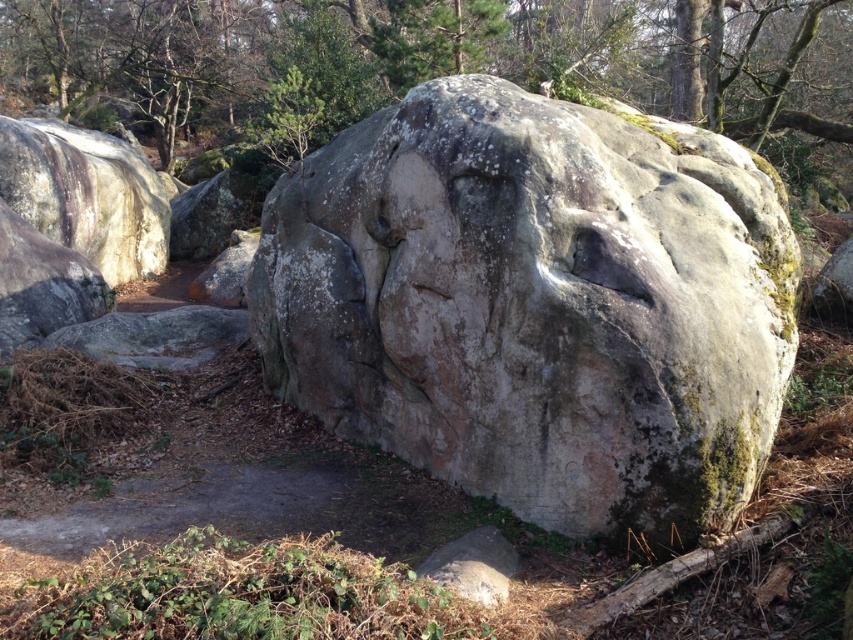
Question: In this image, where is gray stone face at center located relative to green mossy rock at upper center?

Choices:
 (A) above
 (B) below

Answer: (B)

Question: Can you confirm if gray stone face at center is wider than green mossy rock at upper center?

Choices:
 (A) yes
 (B) no

Answer: (B)

Question: Which object is farther from the camera taking this photo?

Choices:
 (A) gray stone face at center
 (B) green mossy rock at upper center

Answer: (B)

Question: Which point appears farthest from the camera in this image?

Choices:
 (A) (18, 74)
 (B) (641, 436)

Answer: (A)

Question: Where is gray stone face at center located in relation to green mossy rock at upper center in the image?

Choices:
 (A) left
 (B) right

Answer: (B)